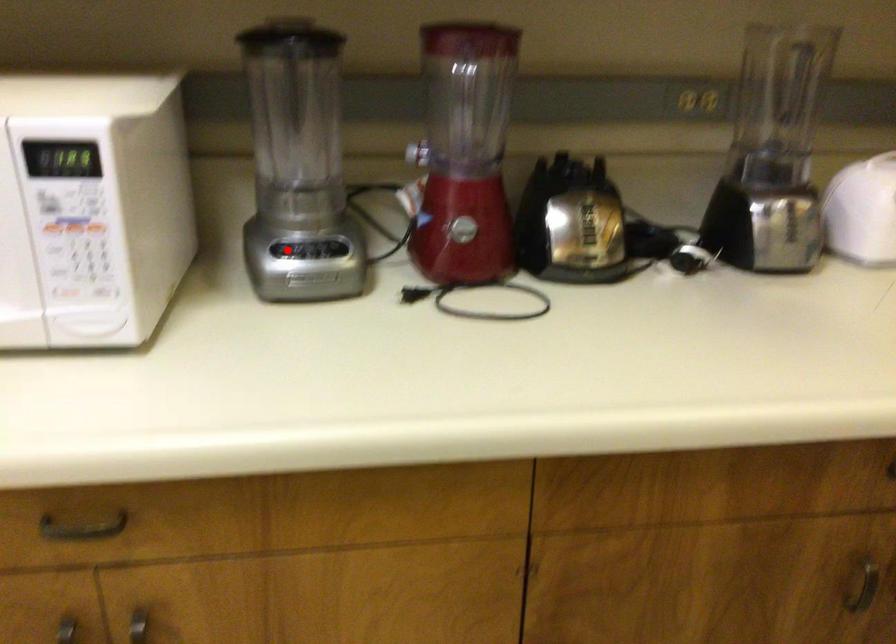
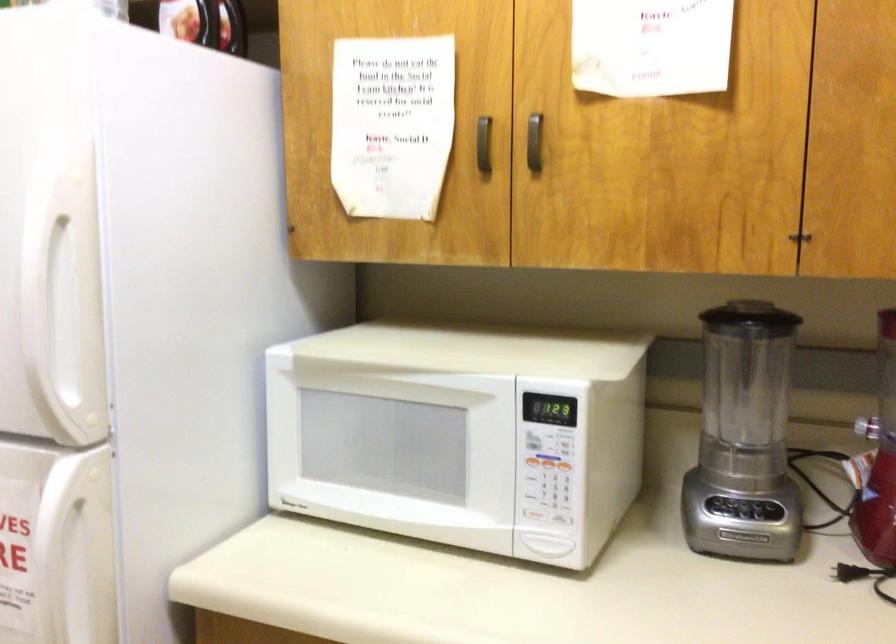
The point at the highlighted location is marked in the first image. Where is the corresponding point in the second image?

(725, 506)